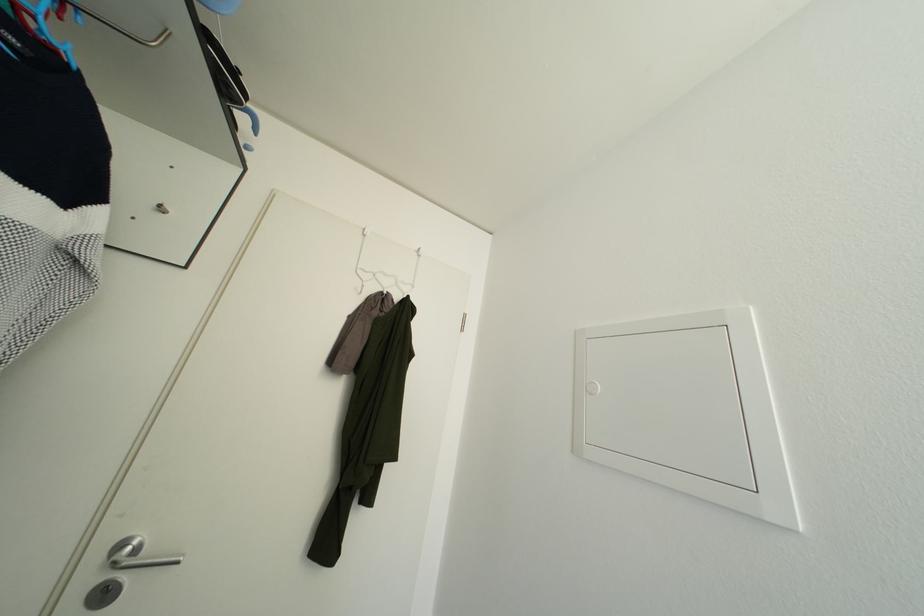
What do you see at coordinates (585, 389) in the screenshot?
I see `the door keyhole` at bounding box center [585, 389].